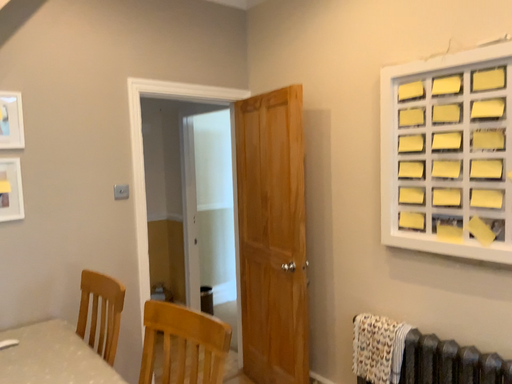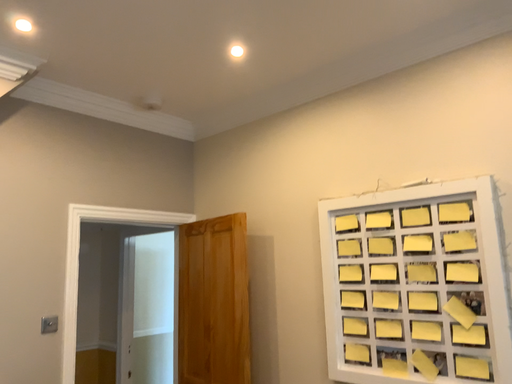
Question: How did the camera likely rotate when shooting the video?

Choices:
 (A) rotated downward
 (B) rotated upward

Answer: (B)